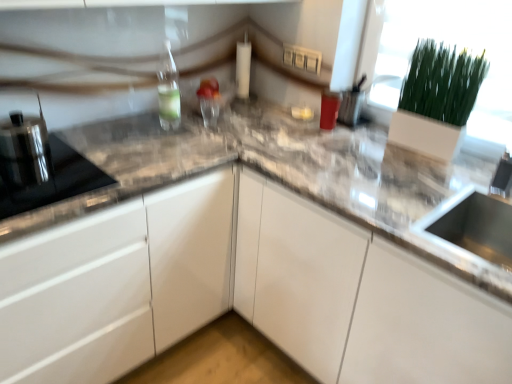
This screenshot has height=384, width=512. In order to click on free space between clear glass bottle at upper left and satin black kettle at left, marked as the first appliance in a left-to-right arrangement in this screenshot , I will do `click(108, 140)`.